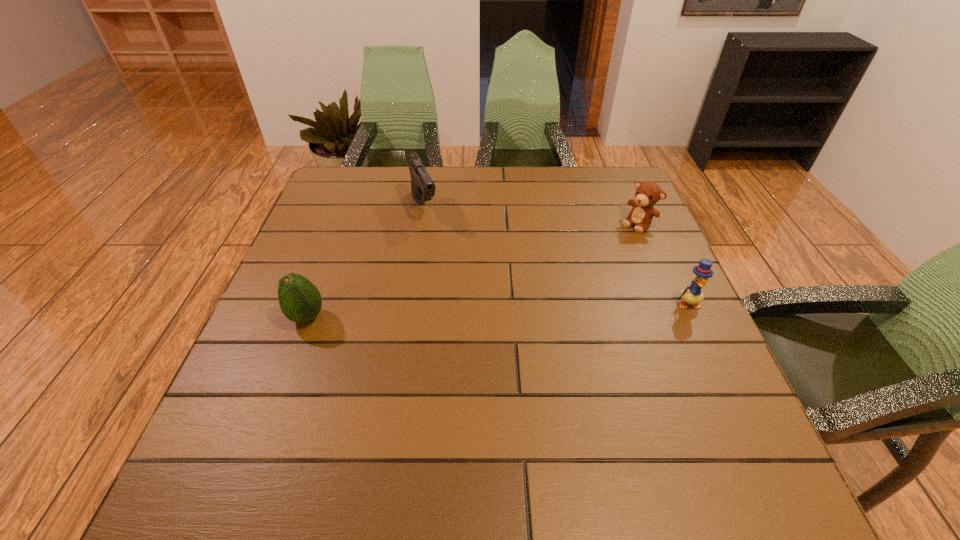
At what (x,y) coordinates should I click in order to perform the action: click on free location at the near left corner of the desktop. Please return your answer as a coordinate pair (x, y). Image resolution: width=960 pixels, height=540 pixels. Looking at the image, I should click on (288, 415).

Where is `free point between the teddy bear and the avocado`? This screenshot has width=960, height=540. free point between the teddy bear and the avocado is located at coordinates (472, 271).

Locate an element on the screen. The width and height of the screenshot is (960, 540). free space between the duckling and the leftmost object is located at coordinates (497, 310).

Image resolution: width=960 pixels, height=540 pixels. I want to click on vacant space in between the teddy bear and the avocado, so click(x=472, y=271).

Where is `free space between the pistol and the duckling`? The image size is (960, 540). free space between the pistol and the duckling is located at coordinates (556, 256).

Identify the location of vacant area between the avocado and the duckling. (497, 310).

The width and height of the screenshot is (960, 540). What are the coordinates of `vacant space that is in between the teddy bear and the duckling` in the screenshot? It's located at pos(662,264).

I want to click on empty location between the pistol and the teddy bear, so click(x=531, y=216).

The image size is (960, 540). What are the coordinates of `vacant space that's between the second object from left to right and the duckling` in the screenshot? It's located at (556, 256).

Identify the location of empty space that is in between the avocado and the teddy bear. Image resolution: width=960 pixels, height=540 pixels. (472, 271).